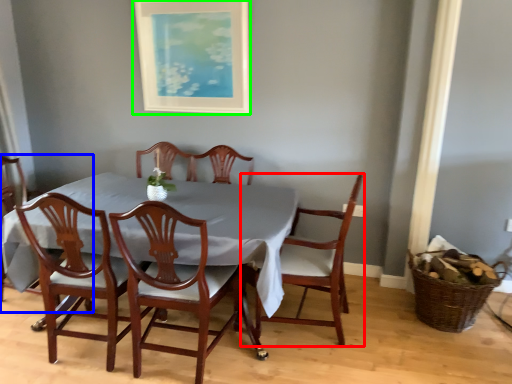
Question: Which is farther away from chair (highlighted by a red box)? chair (highlighted by a blue box) or picture frame (highlighted by a green box)?

Choices:
 (A) chair
 (B) picture frame

Answer: (A)